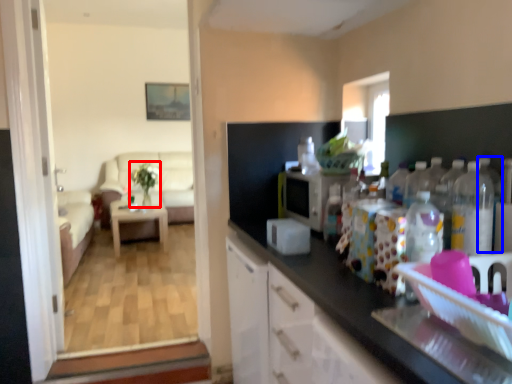
Question: Which object is further to the camera taking this photo, plant (highlighted by a red box) or bottle (highlighted by a blue box)?

Choices:
 (A) plant
 (B) bottle

Answer: (A)